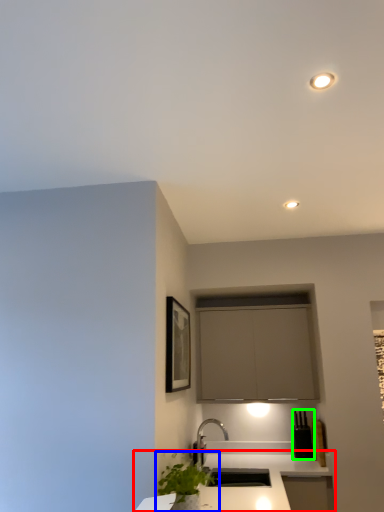
Question: Estimate the real-world distances between objects in this image. Which object is closer to countertop (highlighted by a red box), houseplant (highlighted by a blue box) or appliance (highlighted by a green box)?

Choices:
 (A) houseplant
 (B) appliance

Answer: (B)